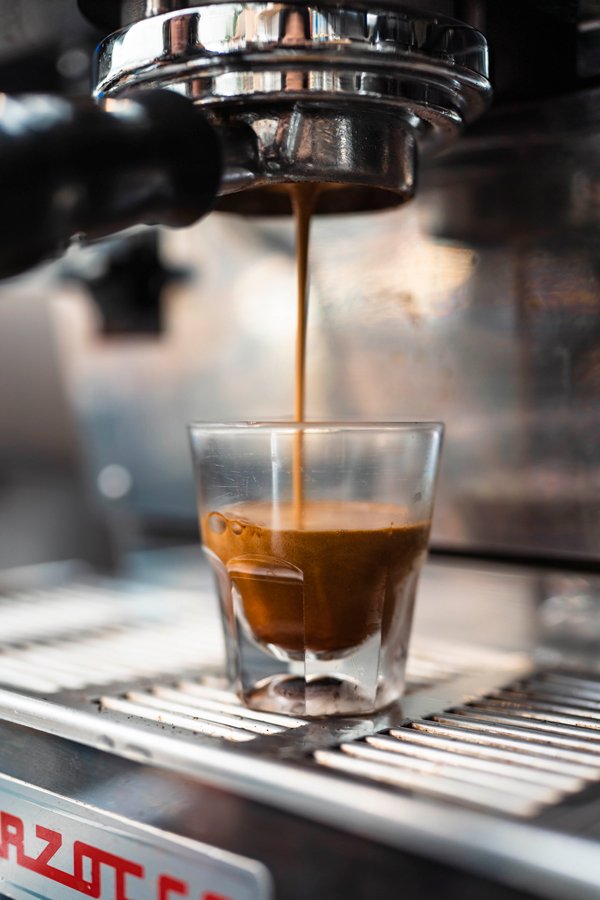
At what (x,y) coordinates should I click in order to perform the action: click on top of glass. Please return your answer as a coordinate pair (x, y). Looking at the image, I should click on (330, 425).